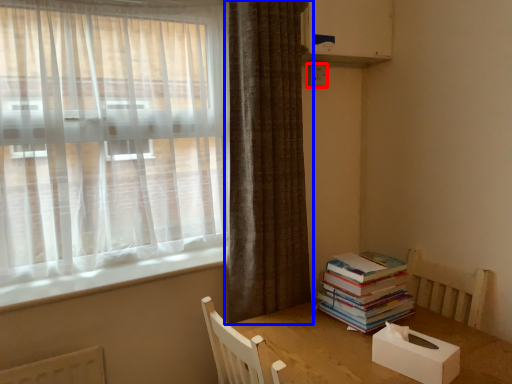
Question: Among these objects, which one is nearest to the camera, electric outlet (highlighted by a red box) or curtain (highlighted by a blue box)?

Choices:
 (A) electric outlet
 (B) curtain

Answer: (B)